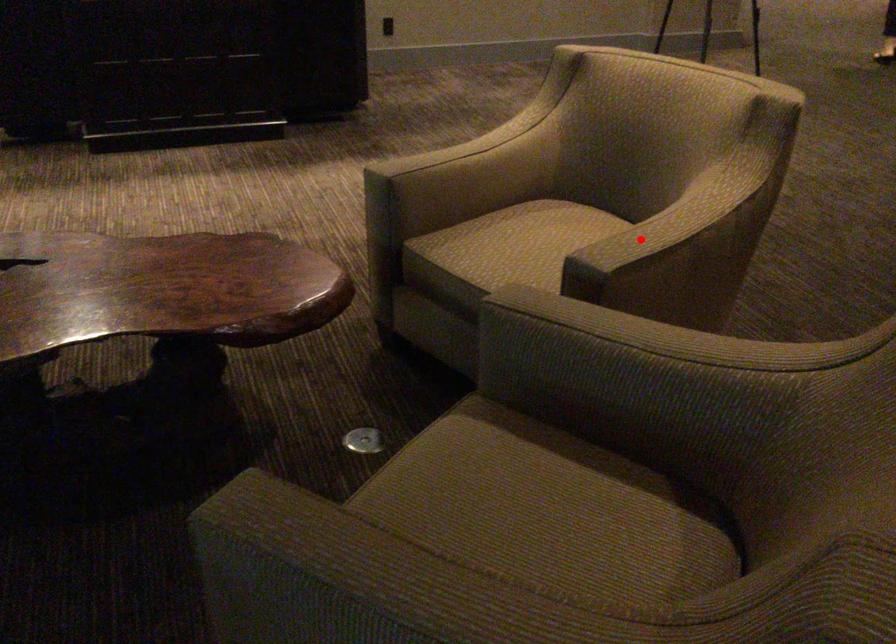
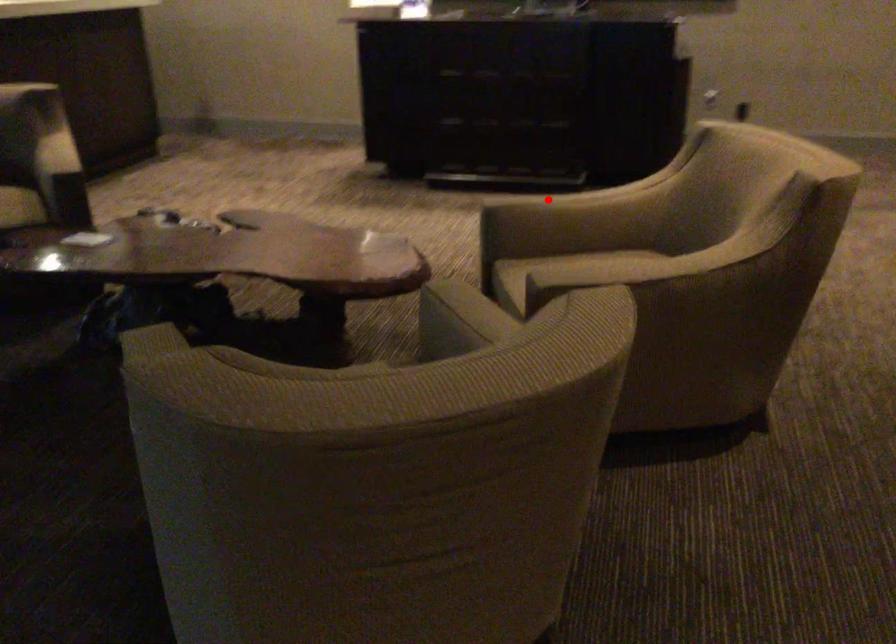
I am providing you with two images of the same scene from different viewpoints. A red point is marked on the first image and another point is marked on the second image. Do the highlighted points in image1 and image2 indicate the same real-world spot?

No